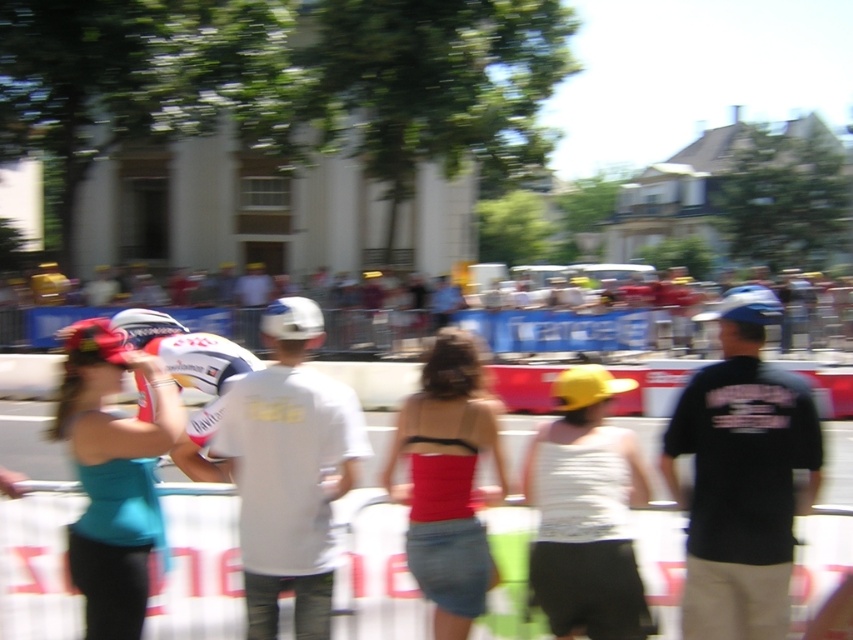
Question: Is white matte helmet at center thinner than white glossy helmet at center?

Choices:
 (A) no
 (B) yes

Answer: (B)

Question: Among these points, which one is nearest to the camera?

Choices:
 (A) (144, 330)
 (B) (135, 337)
 (C) (158, 410)

Answer: (C)

Question: Based on their relative distances, which object is farther from the black cotton t-shirt at right?

Choices:
 (A) white matte helmet at center
 (B) white matte bicycle helmet at center
 (C) white helmet at center

Answer: (C)

Question: Is white matte helmet at center further to the viewer compared to white glossy helmet at center?

Choices:
 (A) no
 (B) yes

Answer: (A)

Question: Which object is the closest to the black cotton t-shirt at right?

Choices:
 (A) matte teal tank top at left
 (B) white matte bicycle helmet at center
 (C) white helmet at center

Answer: (A)

Question: Is black cotton t-shirt at right above white glossy helmet at center?

Choices:
 (A) yes
 (B) no

Answer: (B)